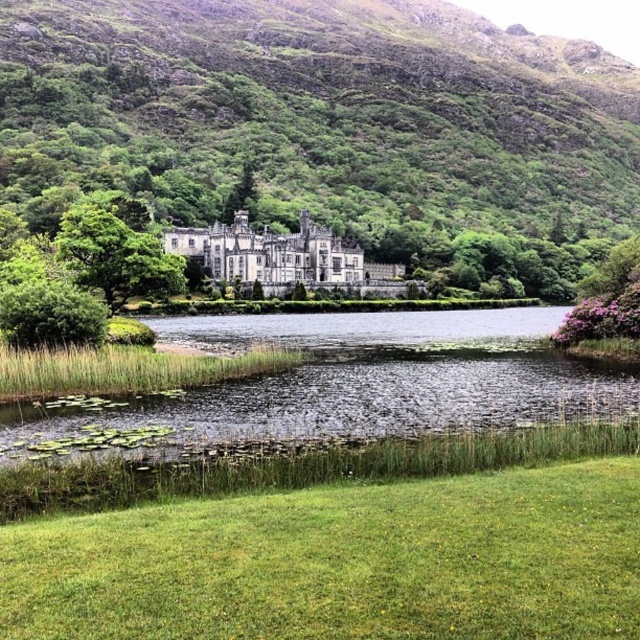
Is stone castle at center positioned in front of green leafy tree at center?

No, stone castle at center is behind green leafy tree at center.

Is point (248, 236) positioned after point (122, 240)?

Yes, point (248, 236) is behind point (122, 240).

Locate an element on the screen. The image size is (640, 640). stone castle at center is located at coordinates (282, 257).

Does green leafy hillside at upper center appear on the right side of green leafy tree at center?

Yes, green leafy hillside at upper center is to the right of green leafy tree at center.

Is green leafy hillside at upper center positioned in front of green leafy tree at center?

No, it is behind green leafy tree at center.

I want to click on green leafy hillside at upper center, so click(x=326, y=125).

Locate an element on the screen. The image size is (640, 640). green leafy hillside at upper center is located at coordinates (326, 125).

Measure the distance between green leafy hillside at upper center and camera.

425.08 feet

What do you see at coordinates (326, 125) in the screenshot? I see `green leafy hillside at upper center` at bounding box center [326, 125].

Is point (531, 132) closer to camera compared to point (356, 246)?

No, (531, 132) is behind (356, 246).

Find the location of a particular element. The width and height of the screenshot is (640, 640). green leafy hillside at upper center is located at coordinates (326, 125).